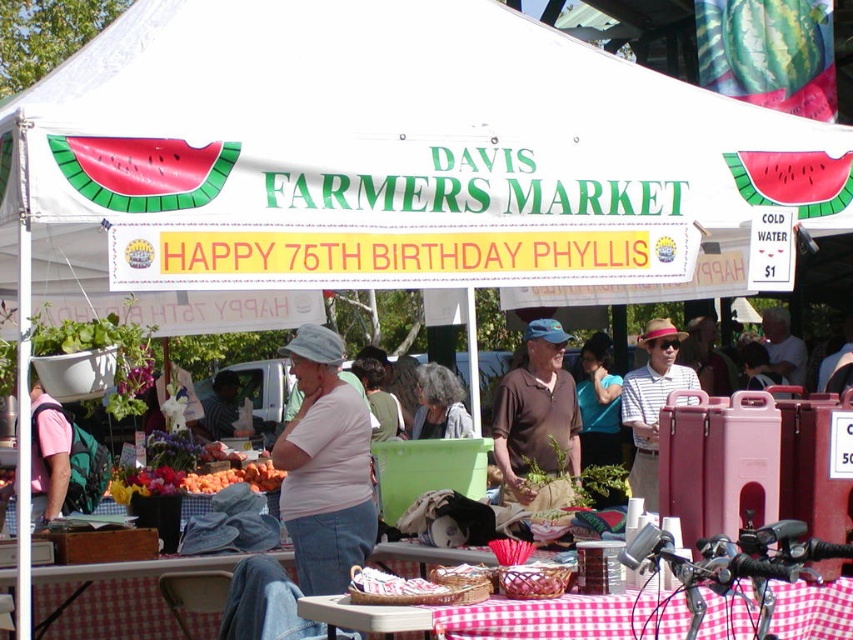
Question: Which of the following is the closest to the observer?

Choices:
 (A) (73, 184)
 (B) (605, 632)

Answer: (B)

Question: Among these points, which one is nearest to the camera?

Choices:
 (A) (412, 157)
 (B) (596, 595)
 (C) (534, 396)

Answer: (B)

Question: Is white fabric canopy at upper center positioned in front of checkered fabric tablecloth at lower center?

Choices:
 (A) no
 (B) yes

Answer: (A)

Question: Does checkered fabric tablecloth at lower center have a lesser width compared to blue fabric shirt at center?

Choices:
 (A) yes
 (B) no

Answer: (B)

Question: Is brown cotton shirt at center above gray hair at center?

Choices:
 (A) no
 (B) yes

Answer: (A)

Question: Which object is the farthest from the blue fabric shirt at center?

Choices:
 (A) brown cotton shirt at center
 (B) white fabric canopy at upper center

Answer: (B)